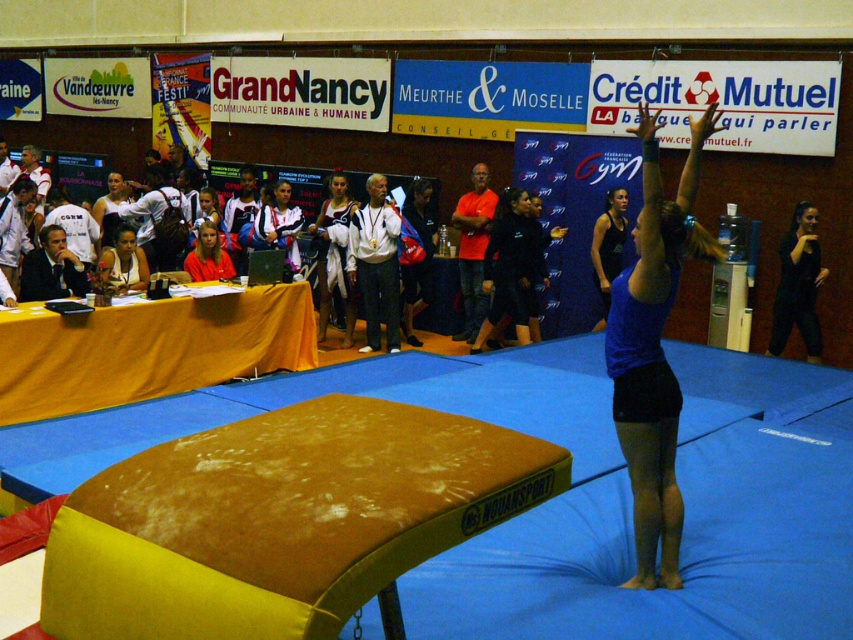
You are a photographer setting up for a gymnastics event. You need to ensure that the blue matte tank top at center and the red fabric shirt at center are both visible in your shot. Given their sizes, which one might you need to position closer to the camera to ensure both are equally visible?

The blue matte tank top at center is larger in size than the red fabric shirt at center, so you can position the red fabric shirt at center closer to the camera to make them appear similar in size in the photo.

You are a gymnast preparing for your routine and need to place two markers on the balance beam. The first marker is at point (323, 273) and the second at point (409, 196). Which marker will appear closer to you when viewed from your position at the edge of the blue mat?

The marker at point (323, 273) will appear closer to you because it is closer to the camera compared to the marker at point (409, 196).